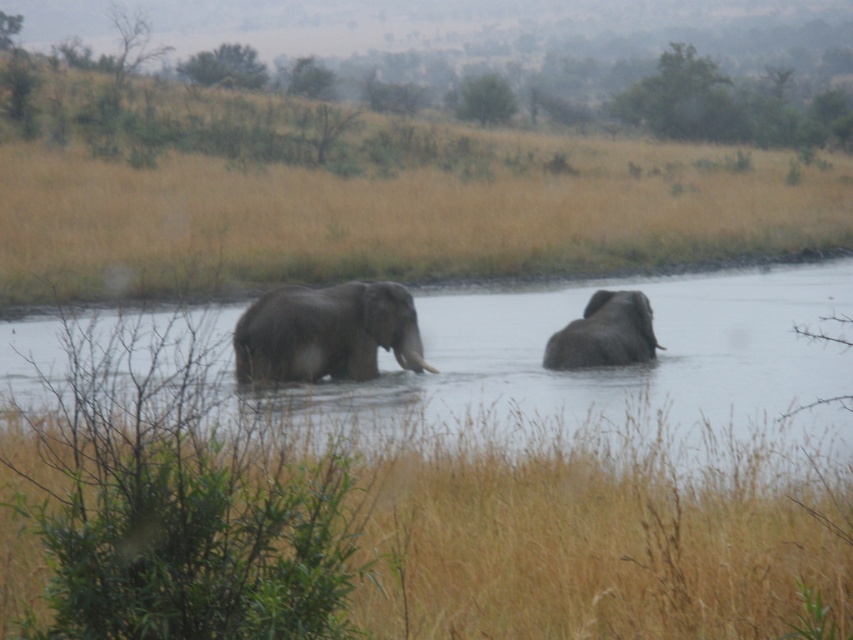
Between dry grass at lower center and gray matte elephant at right, which one is positioned higher?

gray matte elephant at right is above.

Is point (751, 625) more distant than point (563, 358)?

No.

The height and width of the screenshot is (640, 853). Describe the element at coordinates (593, 547) in the screenshot. I see `dry grass at lower center` at that location.

Locate an element on the screen. dry grass at lower center is located at coordinates (593, 547).

How far apart are gray matte elephant at center and gray matte elephant at right?

A distance of 2.48 meters exists between gray matte elephant at center and gray matte elephant at right.

Can you confirm if gray matte elephant at center is positioned to the left of gray matte elephant at right?

Correct, you'll find gray matte elephant at center to the left of gray matte elephant at right.

The height and width of the screenshot is (640, 853). What do you see at coordinates (326, 332) in the screenshot? I see `gray matte elephant at center` at bounding box center [326, 332].

The image size is (853, 640). I want to click on gray matte elephant at center, so click(326, 332).

Is point (785, 614) behind point (677, 435)?

No, (785, 614) is closer to viewer.

Locate an element on the screen. This screenshot has width=853, height=640. dry grass at lower center is located at coordinates (593, 547).

The width and height of the screenshot is (853, 640). What are the coordinates of `dry grass at lower center` in the screenshot? It's located at (593, 547).